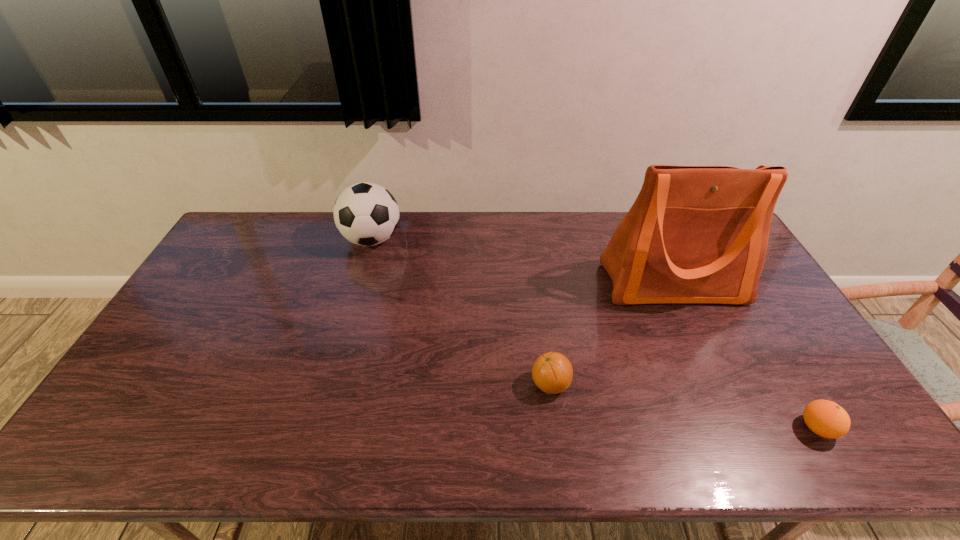
Identify which object is the closest to the leftmost object. Please provide its 2D coordinates. Your answer should be formatted as a tuple, i.e. [(x, y)], where the tuple contains the x and y coordinates of a point satisfying the conditions above.

[(552, 372)]

Image resolution: width=960 pixels, height=540 pixels. In order to click on vacant space that satisfies the following two spatial constraints: 1. on the front side of the right orange; 2. on the right side of the tallest object in this screenshot , I will do `click(738, 428)`.